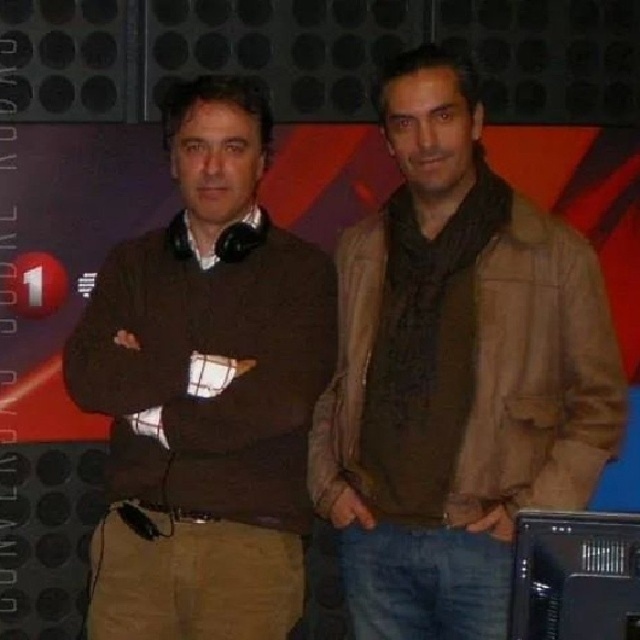
You are a photographer positioned 10 feet away from the camera. You want to capture a closeup shot of the brown leather jacket at center. Can you move closer to the jacket without exceeding the 5 feet distance limit set by the studio?

The distance between the brown leather jacket at center and the camera is 5.99 feet. Since you are already positioned 10 feet away from the camera, moving closer would require reducing your distance to at most 5 feet. However, the jacket is 5.99 feet away from the camera, so if you move to 5 feet from the camera, you would still be 0.99 feet away from the jacket, which is within the limit. Therefore, yes, you can move closer to the jacket while staying within the 5 feet limit set by the studio.

You are a photographer setting up for a photoshoot. You notice the brown leather jacket at center and the brown sweater at center in the scene. Which clothing item is positioned higher on the person?

The brown leather jacket at center is positioned higher than the brown sweater at center because it is above it.

You are a photographer setting up for a photoshoot in the described scene. You need to adjust the lighting to ensure both the brown leather jacket at center and the brown sweater at center are well illuminated. Considering their sizes, which one might require a larger light source to cover adequately?

The brown leather jacket at center is much taller than the brown sweater at center, so it would require a larger light source to ensure proper illumination.